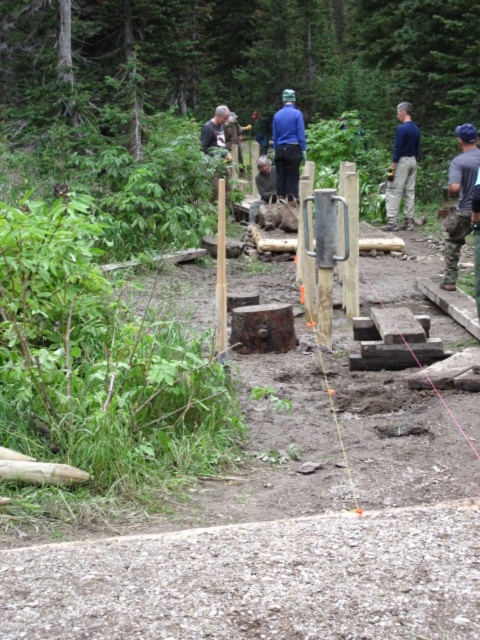
Who is shorter, gravelly dirt trail at lower center or dark brown leather jacket at upper center?

gravelly dirt trail at lower center is shorter.

How distant is gravelly dirt trail at lower center from dark brown leather jacket at upper center?

gravelly dirt trail at lower center and dark brown leather jacket at upper center are 10.90 meters apart from each other.

I want to click on gravelly dirt trail at lower center, so click(255, 579).

The height and width of the screenshot is (640, 480). I want to click on gravelly dirt trail at lower center, so click(x=255, y=579).

Is gravelly dirt trail at lower center bigger than wooden post at center?

Yes.

Does gravelly dirt trail at lower center have a lesser width compared to wooden post at center?

In fact, gravelly dirt trail at lower center might be wider than wooden post at center.

Locate an element on the screen. This screenshot has width=480, height=640. gravelly dirt trail at lower center is located at coordinates (255, 579).

Where is `gravelly dirt trail at lower center`? The image size is (480, 640). gravelly dirt trail at lower center is located at coordinates (255, 579).

Is gravelly dirt trail at lower center further to the viewer compared to camouflage pants at right?

That is False.

Who is lower down, gravelly dirt trail at lower center or camouflage pants at right?

gravelly dirt trail at lower center

Between point (349, 561) and point (475, 152), which one is positioned behind?

Point (475, 152)

Where is `gravelly dirt trail at lower center`? The image size is (480, 640). gravelly dirt trail at lower center is located at coordinates 255,579.